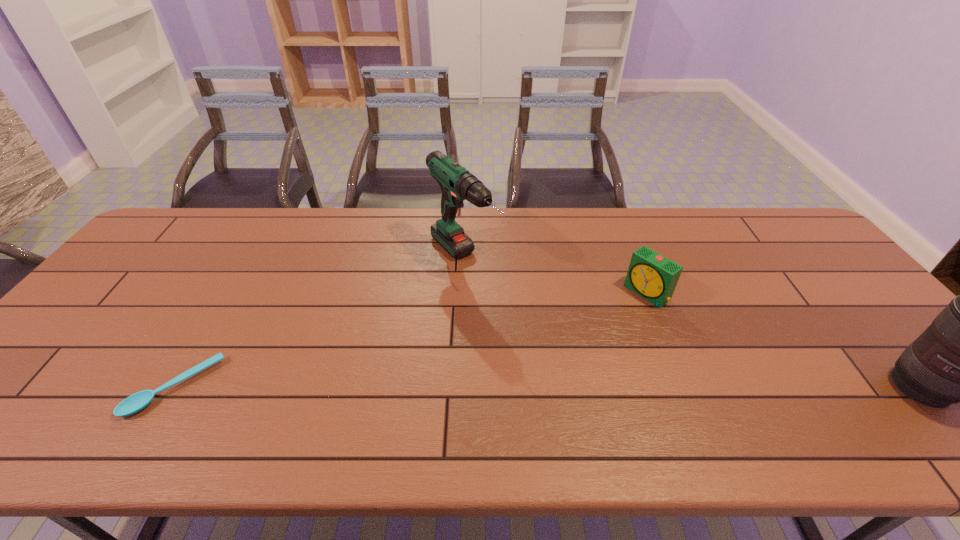
Locate an element on the screen. The image size is (960, 540). the leftmost object is located at coordinates (136, 402).

This screenshot has width=960, height=540. What are the coordinates of `the shortest object` in the screenshot? It's located at (136, 402).

Find the location of a particular element. drill is located at coordinates (457, 184).

At what (x,y) coordinates should I click in order to perform the action: click on the second object from left to right. Please return your answer as a coordinate pair (x, y). Image resolution: width=960 pixels, height=540 pixels. Looking at the image, I should click on (457, 184).

Find the location of a particular element. The height and width of the screenshot is (540, 960). the third object from left to right is located at coordinates (654, 277).

The height and width of the screenshot is (540, 960). What are the coordinates of `alarm clock` in the screenshot? It's located at (654, 277).

This screenshot has height=540, width=960. I want to click on vacant space located 0.290m on the back of the shortest object, so click(241, 278).

Where is `vacant space located on the handle side of the second object from left to right`? vacant space located on the handle side of the second object from left to right is located at coordinates (542, 345).

The image size is (960, 540). I want to click on vacant region located on the handle side of the second object from left to right, so click(495, 298).

At what (x,y) coordinates should I click in order to perform the action: click on free space located on the handle side of the second object from left to right. Please return your answer as a coordinate pair (x, y). This screenshot has width=960, height=540. Looking at the image, I should click on (520, 323).